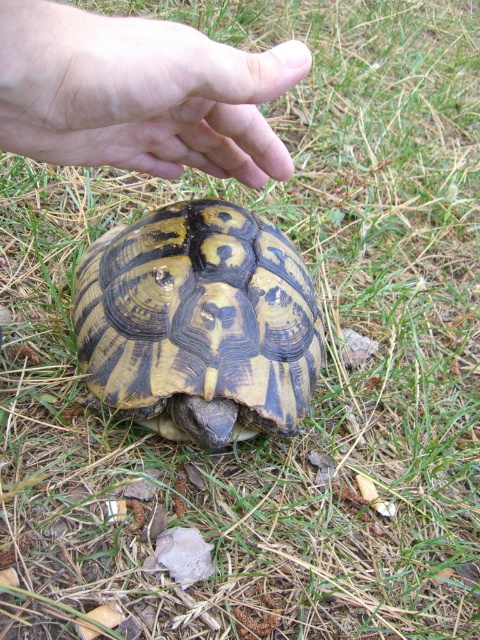
You are a child who wants to touch the turtle. The turtle is the patterned shell tortoise at center and the hand is the smooth skin hand at upper center. Since the turtle is bigger than the hand, will the hand fit on the turtle?

The patterned shell tortoise at center is larger than the smooth skin hand at upper center, so the hand can fit on the turtle.

You see a patterned shell tortoise at center and a smooth skin hand at upper center in the image. Which object is positioned to the left?

The patterned shell tortoise at center is to the left of the smooth skin hand at upper center.

You are observing a turtle on the grass and see two points marked in the image. The first point is at coordinate point (176, 426) and the second point is at coordinate point (240, 161). Which point is closer to you?

Point (176, 426) is further to the viewer than point (240, 161), so the point closer to you is point (240, 161).